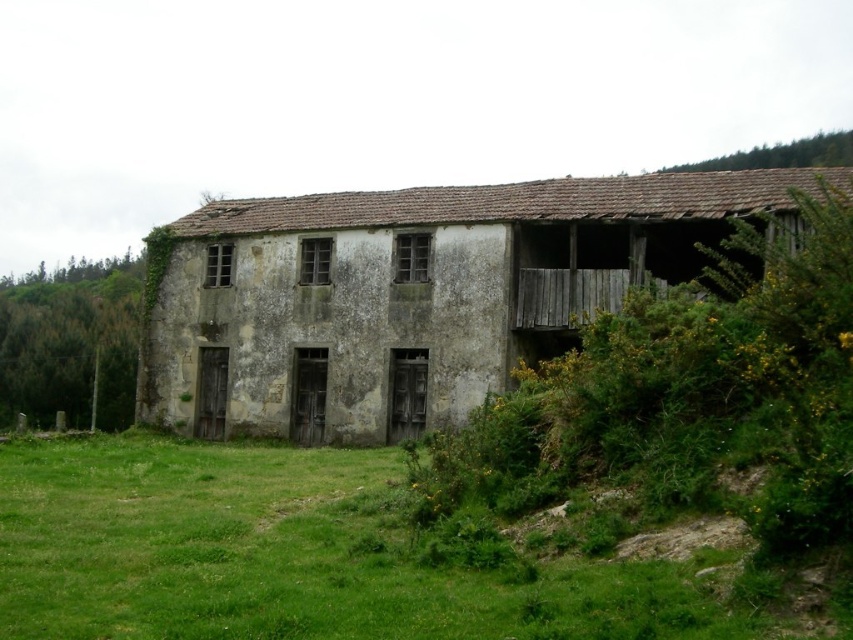
Question: Is weathered concrete hut at center closer to camera compared to green grass at lower left?

Choices:
 (A) yes
 (B) no

Answer: (B)

Question: Which of the following is the closest to the observer?

Choices:
 (A) green grass at lower left
 (B) weathered concrete hut at center

Answer: (A)

Question: Which object appears farthest from the camera in this image?

Choices:
 (A) green grass at lower left
 (B) weathered concrete hut at center

Answer: (B)

Question: Can you confirm if weathered concrete hut at center is positioned to the left of green grass at lower left?

Choices:
 (A) yes
 (B) no

Answer: (B)

Question: Can you confirm if weathered concrete hut at center is wider than green grass at lower left?

Choices:
 (A) no
 (B) yes

Answer: (B)